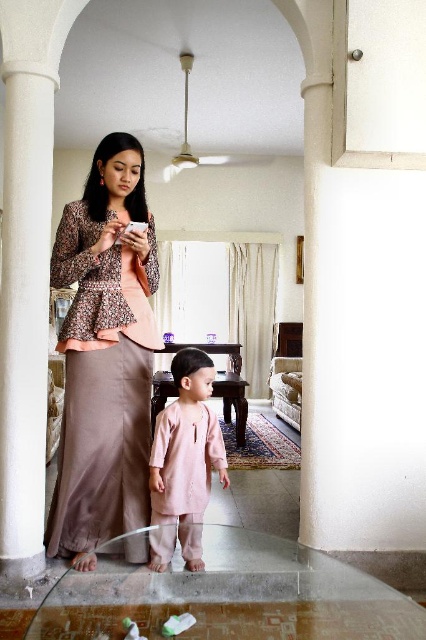
Question: Is matte brown peplum top at center wider than pale pink fabric at center?

Choices:
 (A) no
 (B) yes

Answer: (B)

Question: Where is matte brown peplum top at center located in relation to pale pink fabric at center in the image?

Choices:
 (A) right
 (B) left

Answer: (B)

Question: Which point is farther to the camera?

Choices:
 (A) (146, 401)
 (B) (184, 561)

Answer: (A)

Question: Does matte brown peplum top at center appear under pale pink fabric at center?

Choices:
 (A) yes
 (B) no

Answer: (B)